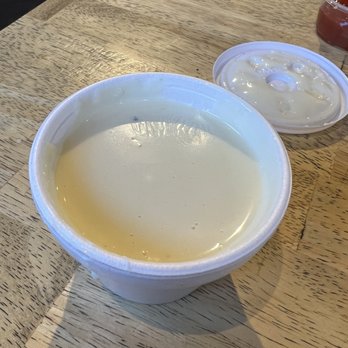
Locate an element on the screen. This screenshot has width=348, height=348. shadow of red jar is located at coordinates (x=330, y=49).